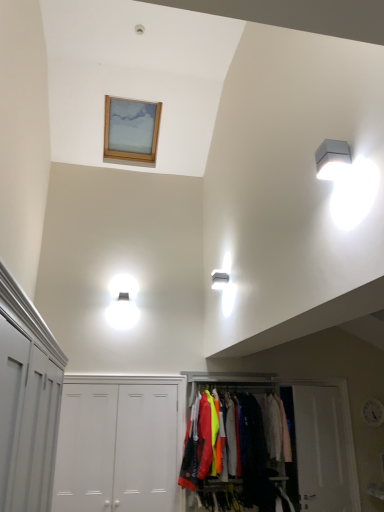
Question: Considering the positions of white matte door at center, which is the 3th door from right to left, and matte fabric clothes rack at center in the image, is white matte door at center, which is the 3th door from right to left, wider or thinner than matte fabric clothes rack at center?

Choices:
 (A) thin
 (B) wide

Answer: (A)

Question: Based on their positions, is white matte door at center, which is the 3th door from right to left, located to the left or right of matte fabric clothes rack at center?

Choices:
 (A) right
 (B) left

Answer: (B)

Question: Considering the real-world distances, which object is closest to the light pink fabric at center?

Choices:
 (A) wooden picture frame at upper center
 (B) white painted wood cabinet at left
 (C) matte fabric clothes rack at center
 (D) white plastic light fixture at upper right
 (E) white matte door at center, which is the second door in left-to-right order

Answer: (C)

Question: Estimate the real-world distances between objects in this image. Which object is closer to the light pink fabric at center?

Choices:
 (A) white plastic light fixture at upper right
 (B) white matte door at lower right, the fourth door when ordered from left to right
 (C) white matte door at center, positioned as the 2th door in right-to-left order
 (D) white matte door at center, which is the second door in left-to-right order
 (E) matte fabric clothes rack at center

Answer: (E)